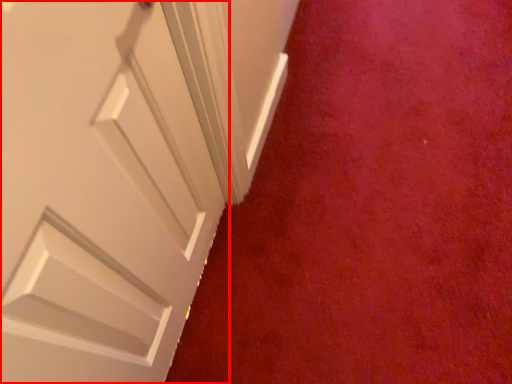
Question: Observing the image, what is the correct spatial positioning of door (annotated by the red box) in reference to plain?

Choices:
 (A) left
 (B) right

Answer: (A)